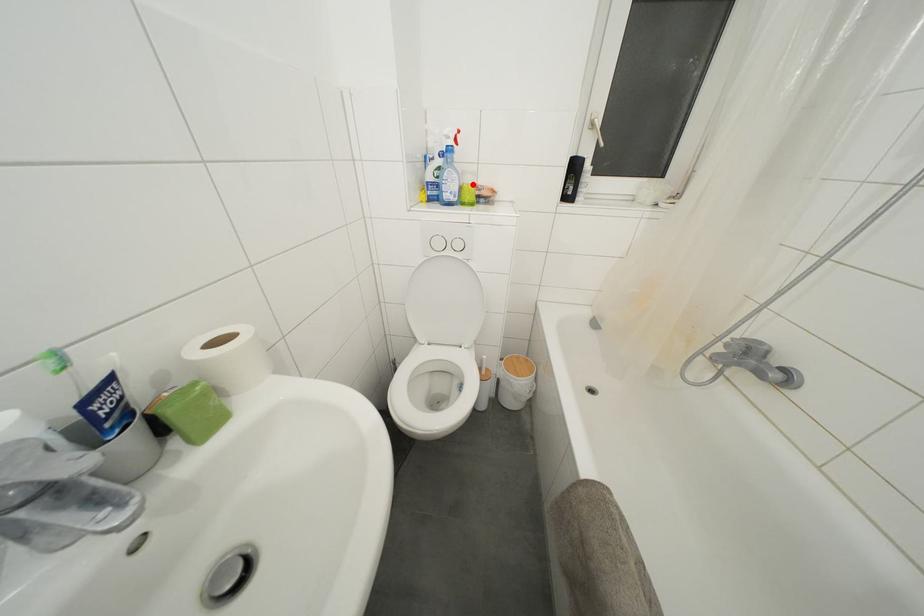
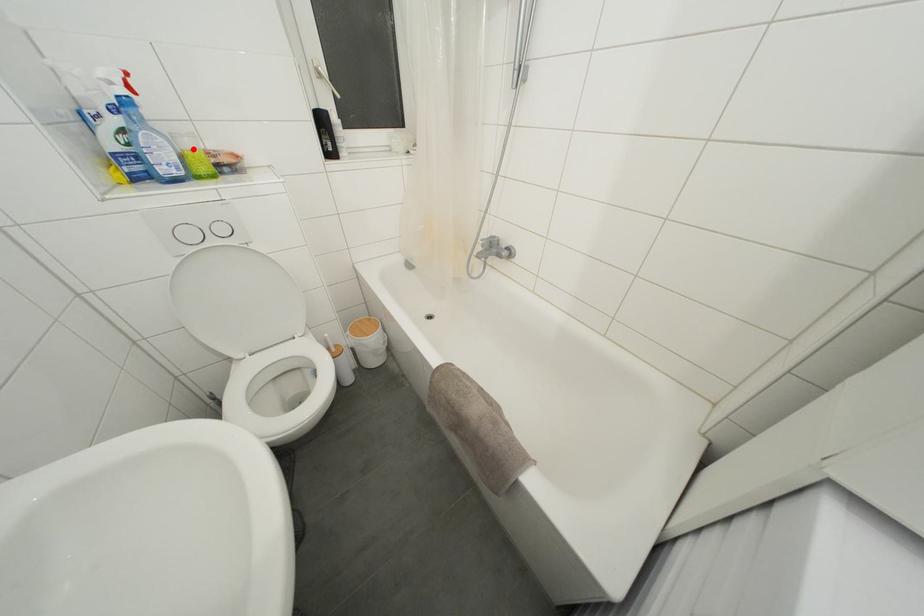
I am providing you with two images of the same scene from different viewpoints. A red point is marked on the first image and another point is marked on the second image. Is the red point in image1 aligned with the point shown in image2?

Yes